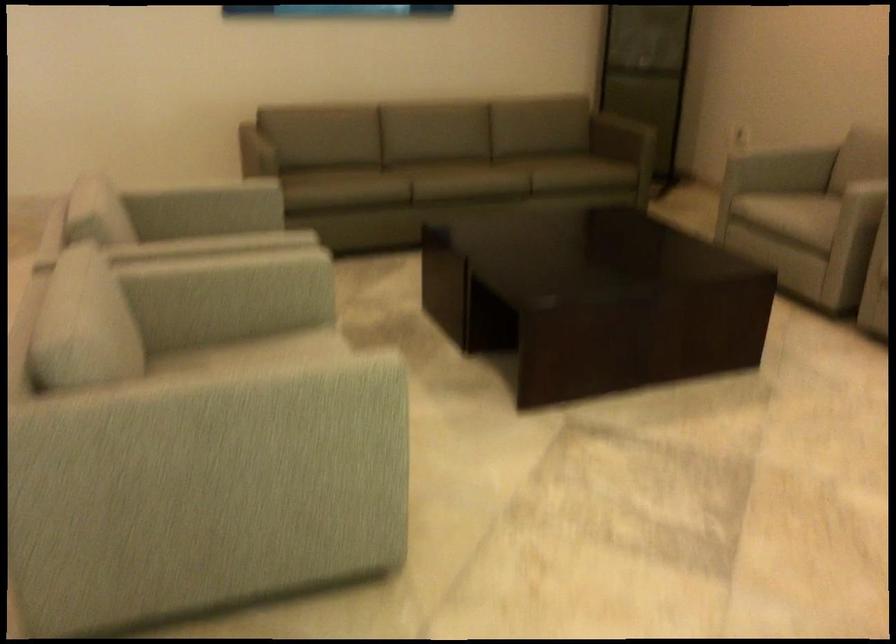
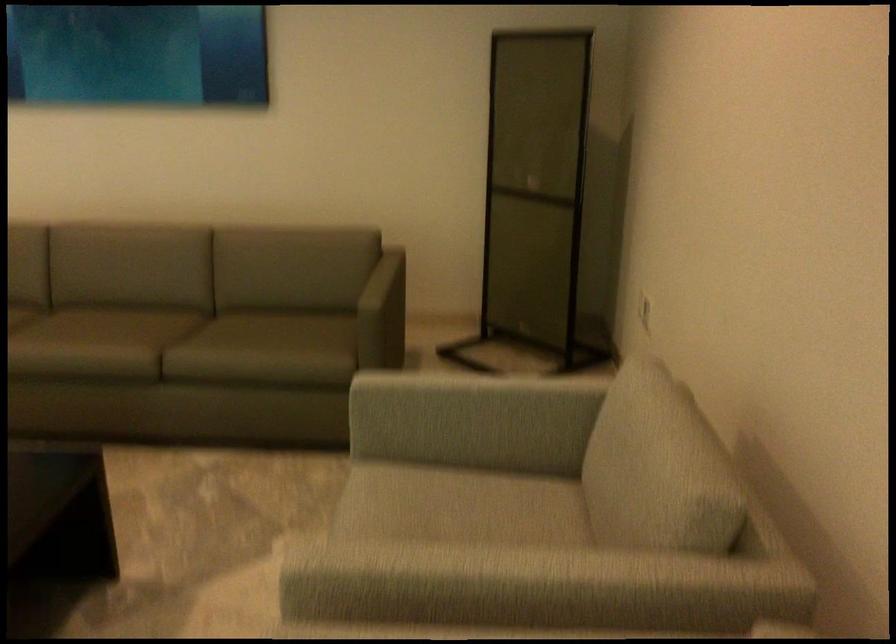
The point at (x=771, y=196) is marked in the first image. Where is the corresponding point in the second image?

(455, 491)